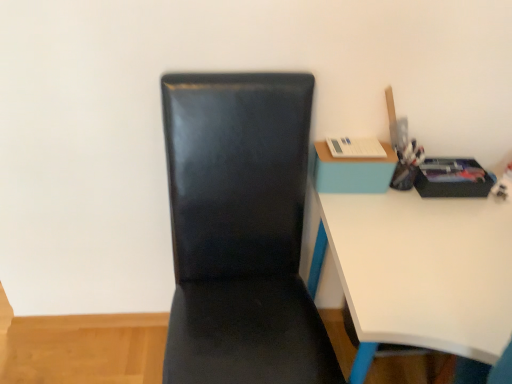
The image size is (512, 384). I want to click on vacant area that is situated to the right of blue matte table at upper right, so click(413, 211).